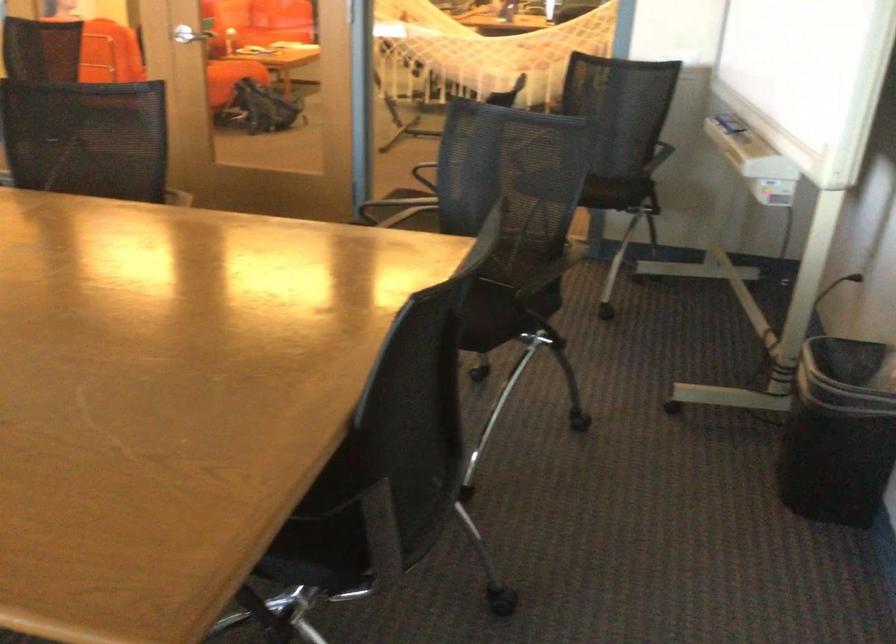
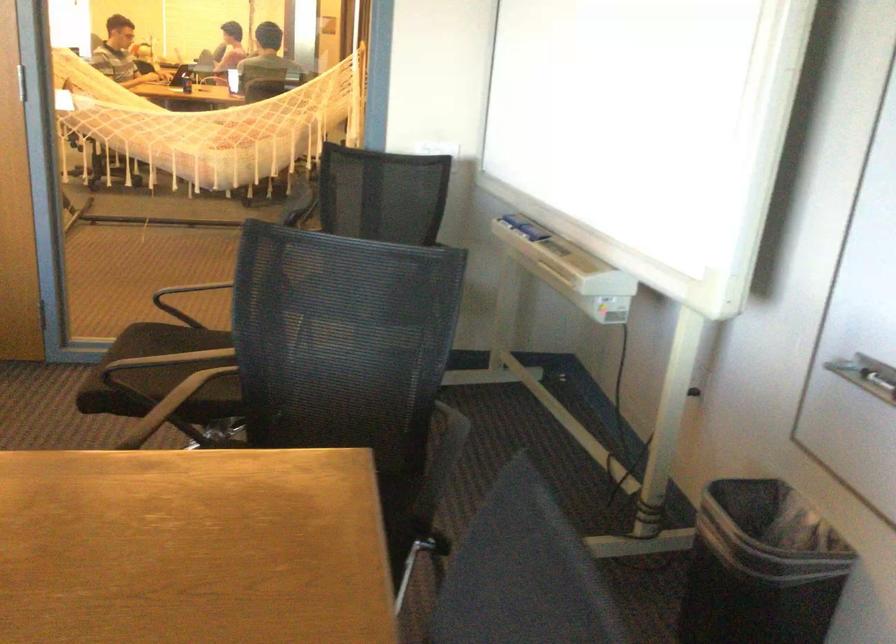
Question: The camera is either moving clockwise (left) or counter-clockwise (right) around the object. The first image is from the beginning of the video and the second image is from the end. Is the camera moving left or right when shooting the video?

Choices:
 (A) Left
 (B) Right

Answer: (A)